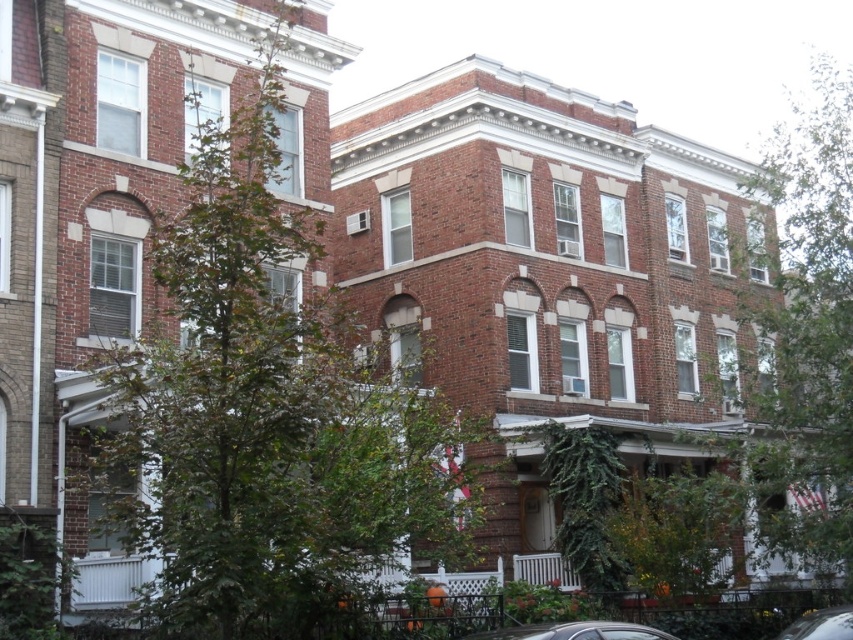
Question: Which point appears closest to the camera in this image?

Choices:
 (A) (846, 324)
 (B) (326, 378)
 (C) (833, 609)
 (D) (560, 632)

Answer: (D)

Question: Is green leafy tree at center above metallic silver car at center?

Choices:
 (A) yes
 (B) no

Answer: (A)

Question: Which point is farther to the camera?

Choices:
 (A) (213, 148)
 (B) (572, 621)

Answer: (B)

Question: Can you confirm if green leafy tree at center is positioned above metallic silver car at center?

Choices:
 (A) no
 (B) yes

Answer: (B)

Question: Does green leafy tree at right have a larger size compared to metallic silver car at lower right?

Choices:
 (A) yes
 (B) no

Answer: (A)

Question: Which point is farther to the camera?

Choices:
 (A) (744, 372)
 (B) (270, 362)
 (C) (601, 637)
 (D) (827, 627)

Answer: (A)